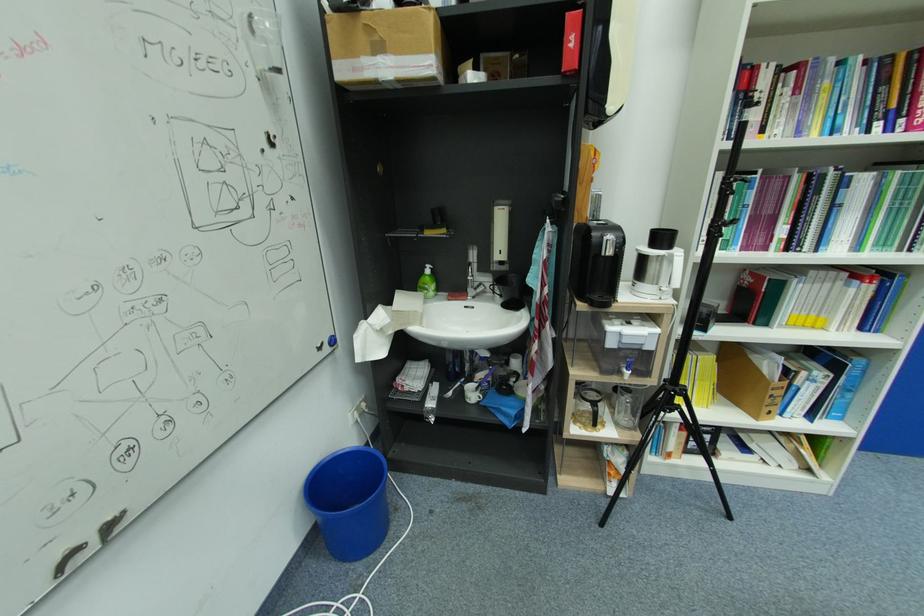
Find the location of a particular element. brown cardboard box is located at coordinates (747, 382).